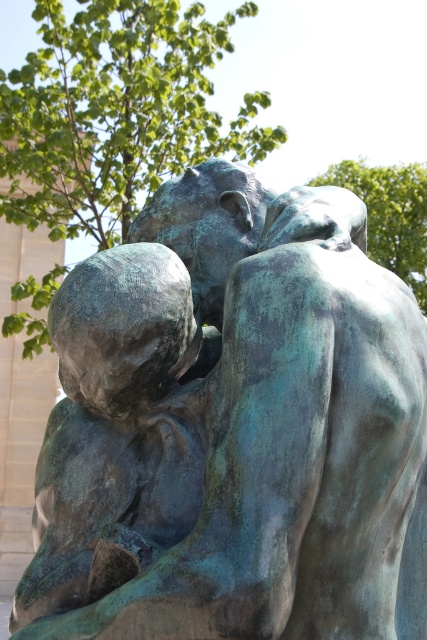
Between point (275, 307) and point (359, 177), which one is positioned in front?

Positioned in front is point (275, 307).

Can you confirm if green patina bronze statue at center is thinner than green verdigris statue at upper center?

Indeed, green patina bronze statue at center has a lesser width compared to green verdigris statue at upper center.

The width and height of the screenshot is (427, 640). What are the coordinates of `green patina bronze statue at center` in the screenshot? It's located at (233, 428).

Does green patina bronze statue at center have a greater height compared to green leafy tree at upper center?

No.

Is point (202, 163) behind point (14, 170)?

No.

You are a GUI agent. You are given a task and a screenshot of the screen. Output one action in this format:
    pyautogui.click(x=<x>, y=<y>)
    Task: Click on the green patina bronze statue at center
    Image resolution: width=427 pixels, height=640 pixels.
    Given the screenshot: What is the action you would take?
    pyautogui.click(x=233, y=428)

Image resolution: width=427 pixels, height=640 pixels. What do you see at coordinates (116, 113) in the screenshot? I see `green leafy tree at upper center` at bounding box center [116, 113].

Does green leafy tree at upper center lie in front of green verdigris statue at upper center?

Yes.

Which is behind, point (11, 204) or point (415, 282)?

The point (415, 282) is behind.

Where is `green leafy tree at upper center`? The width and height of the screenshot is (427, 640). green leafy tree at upper center is located at coordinates (116, 113).